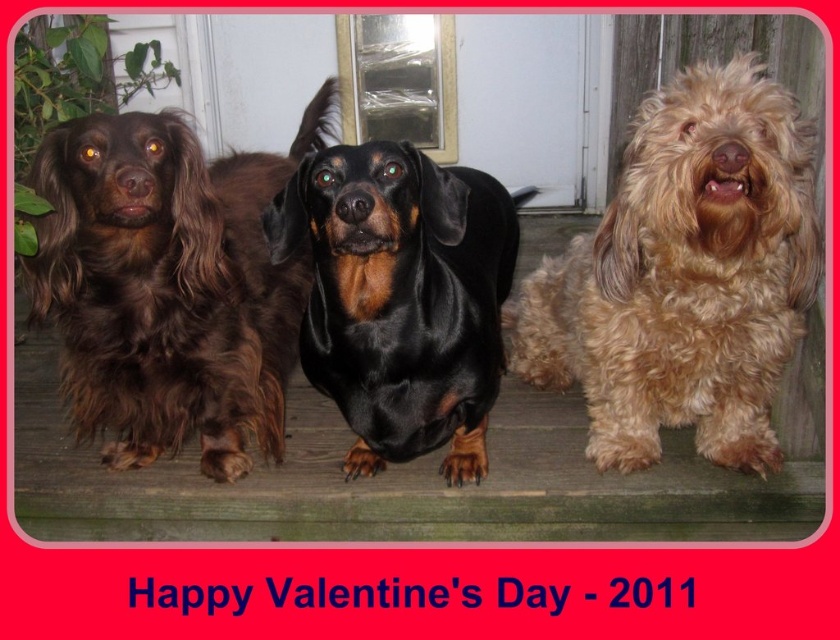
You are standing on the wooden deck and need to locate the fuzzy golden dog at right. According to the coordinates provided, where exactly should you look?

The fuzzy golden dog at right is located at the 2D coordinates point (684, 275).